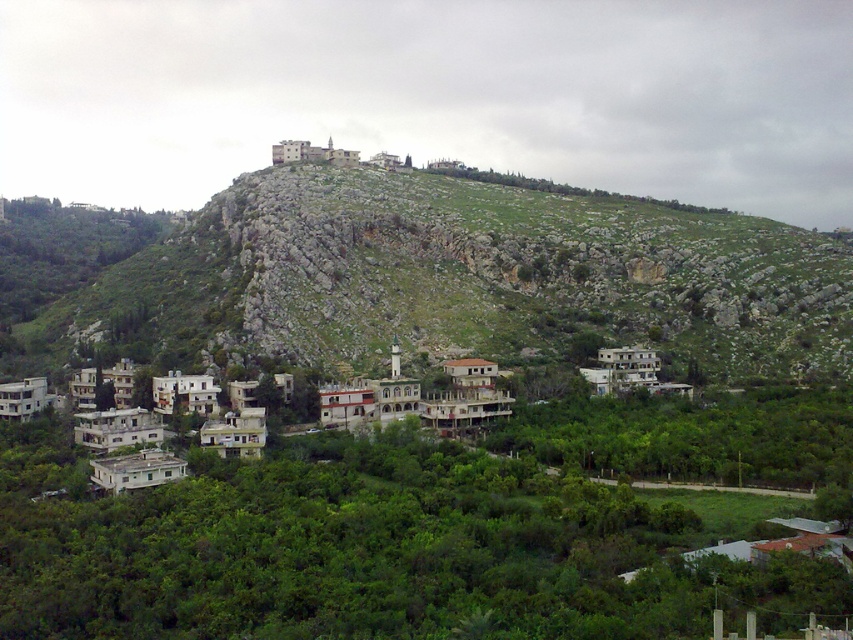
Does green rocky mountain at upper center have a smaller size compared to white concrete buildings at lower left?

No.

Is green rocky mountain at upper center taller than white concrete buildings at lower left?

Correct, green rocky mountain at upper center is much taller as white concrete buildings at lower left.

What are the coordinates of `green rocky mountain at upper center` in the screenshot? It's located at (448, 275).

Find the location of a particular element. This screenshot has width=853, height=640. green rocky mountain at upper center is located at coordinates (x=448, y=275).